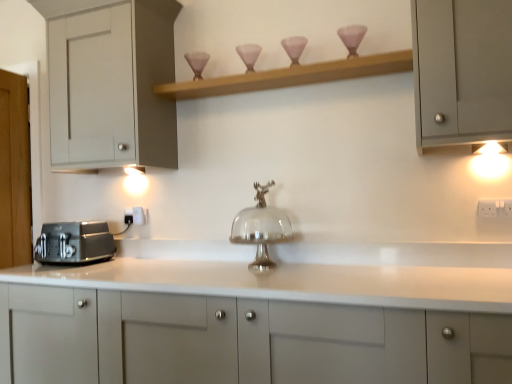
Question: Does point (74, 243) appear closer or farther from the camera than point (361, 24)?

Choices:
 (A) farther
 (B) closer

Answer: (A)

Question: Based on their positions, is matte black toaster at left located to the left or right of matte glass candle holder at upper center?

Choices:
 (A) left
 (B) right

Answer: (A)

Question: Which of these objects is positioned farthest from the white plastic electric outlet at center, marked as the first electric outlet in a left-to-right arrangement?

Choices:
 (A) matte glass candle holder at upper center
 (B) clear glass cake stand at center
 (C) white plastic electric outlet at right, the first electric outlet viewed from the front
 (D) matte black toaster at left
 (E) matte gray cabinet at upper right, acting as the second cabinetry starting from the top

Answer: (C)

Question: Based on their relative distances, which object is nearer to the clear glass cake stand at center?

Choices:
 (A) wooden shelf at upper center
 (B) warm matte light fixture at upper right
 (C) white glossy cabinet at center, which ranks as the third cabinetry in top-to-bottom order
 (D) white plastic electric outlet at center, the first electric outlet viewed from the back
 (E) matte glass candle holder at upper center

Answer: (C)